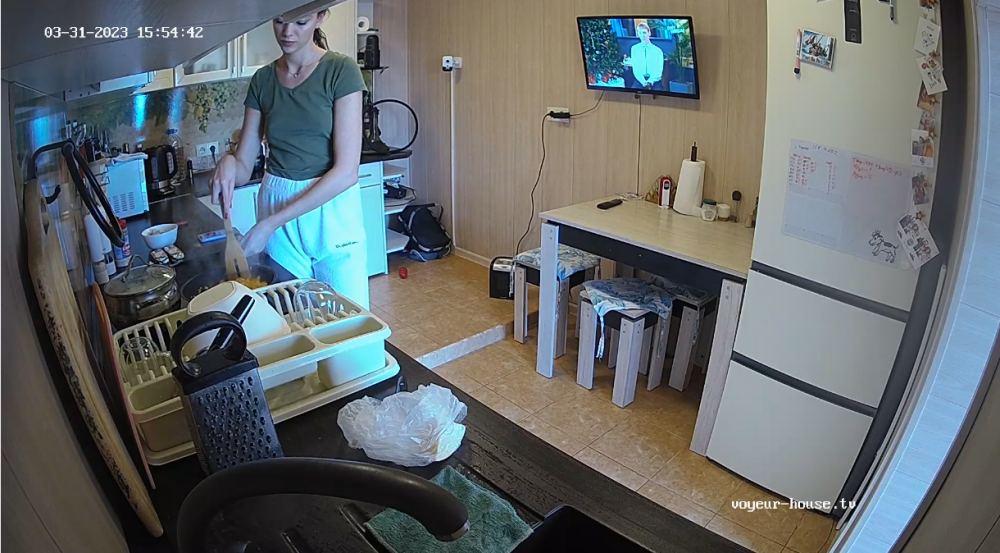
Where is `table stool`? This screenshot has width=1000, height=553. table stool is located at coordinates (633, 339), (521, 265).